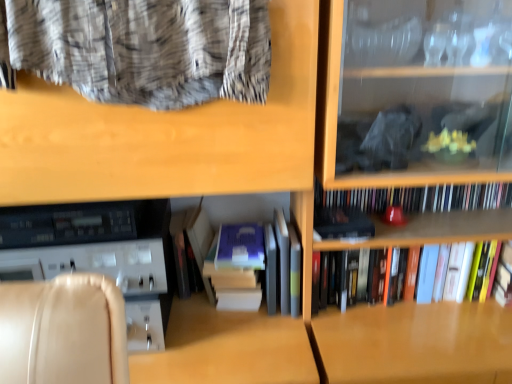
The height and width of the screenshot is (384, 512). Describe the element at coordinates (287, 264) in the screenshot. I see `hardcover book at center, marked as the 2th book in a top-to-bottom arrangement` at that location.

Find the location of a particular element. blue matte paperback book at center, the 2th paperback book when ordered from right to left is located at coordinates (240, 246).

Locate an element on the screen. hardcover book at center, arranged as the 2th book when ordered from the bottom is located at coordinates (287, 264).

From a real-world perspective, does hardcover book at center, arranged as the 2th book when ordered from the bottom, sit lower than blue matte paperback book at center, the 2th paperback book when ordered from right to left?

Indeed, from a real-world perspective, hardcover book at center, arranged as the 2th book when ordered from the bottom, is positioned beneath blue matte paperback book at center, the 2th paperback book when ordered from right to left.

Looking at this image, from the image's perspective, does hardcover book at center, arranged as the 2th book when ordered from the bottom, appear lower than blue matte paperback book at center, the first paperback book in the left-to-right sequence?

Yes.

You are a GUI agent. You are given a task and a screenshot of the screen. Output one action in this format:
    pyautogui.click(x=<x>, y=<y>)
    Task: Click on the 1st book below the blue matte paperback book at center, the 2th paperback book when ordered from right to left (from the image's perspective)
    This screenshot has height=384, width=512.
    Given the screenshot: What is the action you would take?
    pyautogui.click(x=287, y=264)

Are hardcover book at center, marked as the 2th book in a top-to-bottom arrangement, and blue matte paperback book at center, the 2th paperback book when ordered from right to left, beside each other?

Yes, the surface of hardcover book at center, marked as the 2th book in a top-to-bottom arrangement, is in contact with blue matte paperback book at center, the 2th paperback book when ordered from right to left.

Is blue matte paperback book at center, the first paperback book in the left-to-right sequence, aimed at hardcover books at center, which appears as the third book when ordered from the bottom?

No, blue matte paperback book at center, the first paperback book in the left-to-right sequence, is not oriented towards hardcover books at center, which appears as the third book when ordered from the bottom.

From a real-world perspective, is blue matte paperback book at center, the first paperback book in the left-to-right sequence, physically below hardcover books at center, the first book positioned from the top?

Yes, from a real-world perspective, blue matte paperback book at center, the first paperback book in the left-to-right sequence, is under hardcover books at center, the first book positioned from the top.

Is matte black book at center, the second paperback book viewed from the left, further to camera compared to hardcover books at center, which is the 1th book in bottom-to-top order?

No, the depth of matte black book at center, the second paperback book viewed from the left, is less than that of hardcover books at center, which is the 1th book in bottom-to-top order.

Which object is wider, matte black book at center, the second paperback book viewed from the left, or hardcover books at center, which is the third book from top to bottom?

With larger width is matte black book at center, the second paperback book viewed from the left.

Where is `the 2nd book below the matte black book at center, marked as the first paperback book in a right-to-left arrangement (from the image's perspective)`? The width and height of the screenshot is (512, 384). the 2nd book below the matte black book at center, marked as the first paperback book in a right-to-left arrangement (from the image's perspective) is located at coordinates (420, 274).

Is hardcover books at center, the first book positioned from the top, oriented away from hardcover books at center, which is the third book from top to bottom?

No, hardcover books at center, the first book positioned from the top, is not facing the opposite direction of hardcover books at center, which is the third book from top to bottom.

From the image's perspective, does hardcover books at center, which appears as the third book when ordered from the bottom, appear higher than hardcover books at center, which is the third book from top to bottom?

Yes.

From a real-world perspective, does hardcover books at center, the first book positioned from the top, stand above hardcover books at center, which is the 1th book in bottom-to-top order?

Yes, from a real-world perspective, hardcover books at center, the first book positioned from the top, is above hardcover books at center, which is the 1th book in bottom-to-top order.

From a real-world perspective, is hardcover books at center, which is the third book from top to bottom, on hardcover books at center, the first book positioned from the top?

Actually, hardcover books at center, which is the third book from top to bottom, is physically below hardcover books at center, the first book positioned from the top, in the real world.

Can we say hardcover books at center, which is the third book from top to bottom, lies outside hardcover books at center, the first book positioned from the top?

Yes.

Considering the positions of objects hardcover books at center, which is the third book from top to bottom, and hardcover books at center, which appears as the third book when ordered from the bottom, in the image provided, who is more to the left, hardcover books at center, which is the third book from top to bottom, or hardcover books at center, which appears as the third book when ordered from the bottom,?

hardcover books at center, which is the third book from top to bottom.

Which object is thinner, hardcover books at center, which is the 1th book in bottom-to-top order, or hardcover books at center, the first book positioned from the top?

hardcover books at center, the first book positioned from the top.

From the picture: Would you say matte black book at center, marked as the first paperback book in a right-to-left arrangement, contains blue matte paperback book at center, the first paperback book in the left-to-right sequence?

That's incorrect, blue matte paperback book at center, the first paperback book in the left-to-right sequence, is not inside matte black book at center, marked as the first paperback book in a right-to-left arrangement.

Considering the relative sizes of matte black book at center, marked as the first paperback book in a right-to-left arrangement, and blue matte paperback book at center, the first paperback book in the left-to-right sequence, in the image provided, is matte black book at center, marked as the first paperback book in a right-to-left arrangement, wider than blue matte paperback book at center, the first paperback book in the left-to-right sequence,?

In fact, matte black book at center, marked as the first paperback book in a right-to-left arrangement, might be narrower than blue matte paperback book at center, the first paperback book in the left-to-right sequence.

From the image's perspective, which is below, matte black book at center, marked as the first paperback book in a right-to-left arrangement, or blue matte paperback book at center, the first paperback book in the left-to-right sequence?

blue matte paperback book at center, the first paperback book in the left-to-right sequence, from the image's perspective.

Identify the location of the 2nd book to the left of the hardcover books at center, which appears as the third book when ordered from the bottom, counting from the anchor's position. (287, 264).

Does hardcover books at center, which appears as the third book when ordered from the bottom, come in front of hardcover book at center, marked as the 2th book in a top-to-bottom arrangement?

No, it is not.

Which is more to the right, hardcover books at center, which appears as the third book when ordered from the bottom, or hardcover book at center, marked as the 2th book in a top-to-bottom arrangement?

Positioned to the right is hardcover books at center, which appears as the third book when ordered from the bottom.

Who is smaller, hardcover books at center, the first book positioned from the top, or hardcover book at center, arranged as the 2th book when ordered from the bottom?

Smaller between the two is hardcover books at center, the first book positioned from the top.

Image resolution: width=512 pixels, height=384 pixels. I want to click on the 1st book below the blue matte paperback book at center, the first paperback book in the left-to-right sequence (from a real-world perspective), so point(287,264).

What are the coordinates of `book located above the blue matte paperback book at center, the first paperback book in the left-to-right sequence (from the image's perspective)` in the screenshot? It's located at (419, 197).

Which object lies nearer to the anchor point hardcover books at center, which is the third book from top to bottom, matte black book at center, marked as the first paperback book in a right-to-left arrangement, or hardcover book at center, arranged as the 2th book when ordered from the bottom?

matte black book at center, marked as the first paperback book in a right-to-left arrangement, lies closer to hardcover books at center, which is the third book from top to bottom, than the other object.

Estimate the real-world distances between objects in this image. Which object is further from blue matte paperback book at center, the 2th paperback book when ordered from right to left, hardcover books at center, which is the third book from top to bottom, or matte black book at center, marked as the first paperback book in a right-to-left arrangement?

Among the two, hardcover books at center, which is the third book from top to bottom, is located further to blue matte paperback book at center, the 2th paperback book when ordered from right to left.

Based on their spatial positions, is hardcover book at center, marked as the 2th book in a top-to-bottom arrangement, or hardcover books at center, which is the third book from top to bottom, further from hardcover books at center, which appears as the third book when ordered from the bottom?

hardcover book at center, marked as the 2th book in a top-to-bottom arrangement.

In the scene shown: Considering their positions, is hardcover book at center, arranged as the 2th book when ordered from the bottom, positioned closer to hardcover books at center, which is the 1th book in bottom-to-top order, than hardcover books at center, the first book positioned from the top?

Among the two, hardcover books at center, the first book positioned from the top, is located nearer to hardcover books at center, which is the 1th book in bottom-to-top order.

In the scene shown: Estimate the real-world distances between objects in this image. Which object is closer to blue matte paperback book at center, the 2th paperback book when ordered from right to left, hardcover books at center, which is the third book from top to bottom, or hardcover book at center, marked as the 2th book in a top-to-bottom arrangement?

Based on the image, hardcover book at center, marked as the 2th book in a top-to-bottom arrangement, appears to be nearer to blue matte paperback book at center, the 2th paperback book when ordered from right to left.

Which object lies further to the anchor point matte black book at center, marked as the first paperback book in a right-to-left arrangement, hardcover books at center, the first book positioned from the top, or blue matte paperback book at center, the 2th paperback book when ordered from right to left?

blue matte paperback book at center, the 2th paperback book when ordered from right to left, is further to matte black book at center, marked as the first paperback book in a right-to-left arrangement.

Estimate the real-world distances between objects in this image. Which object is closer to hardcover books at center, which appears as the third book when ordered from the bottom, matte black book at center, the second paperback book viewed from the left, or hardcover books at center, which is the 1th book in bottom-to-top order?

matte black book at center, the second paperback book viewed from the left, is positioned closer to the anchor hardcover books at center, which appears as the third book when ordered from the bottom.

Based on their spatial positions, is blue matte paperback book at center, the first paperback book in the left-to-right sequence, or matte black book at center, marked as the first paperback book in a right-to-left arrangement, closer to hardcover books at center, which is the third book from top to bottom?

matte black book at center, marked as the first paperback book in a right-to-left arrangement, is positioned closer to the anchor hardcover books at center, which is the third book from top to bottom.

At what (x,y) coordinates should I click in order to perform the action: click on paperback book between hardcover book at center, marked as the 2th book in a top-to-bottom arrangement, and hardcover books at center, which is the third book from top to bottom. Please return your answer as a coordinate pair (x, y). This screenshot has width=512, height=384. Looking at the image, I should click on (342, 223).

Locate an element on the screen. This screenshot has height=384, width=512. book located between matte black book at center, marked as the first paperback book in a right-to-left arrangement, and hardcover books at center, which appears as the third book when ordered from the bottom, in the left-right direction is located at coordinates (420, 274).

The height and width of the screenshot is (384, 512). Find the location of `book located between blue matte paperback book at center, the 2th paperback book when ordered from right to left, and matte black book at center, marked as the first paperback book in a right-to-left arrangement, in the left-right direction`. book located between blue matte paperback book at center, the 2th paperback book when ordered from right to left, and matte black book at center, marked as the first paperback book in a right-to-left arrangement, in the left-right direction is located at coordinates (287, 264).

The width and height of the screenshot is (512, 384). What are the coordinates of `book located between blue matte paperback book at center, the first paperback book in the left-to-right sequence, and hardcover books at center, which is the third book from top to bottom, in the left-right direction` in the screenshot? It's located at (287, 264).